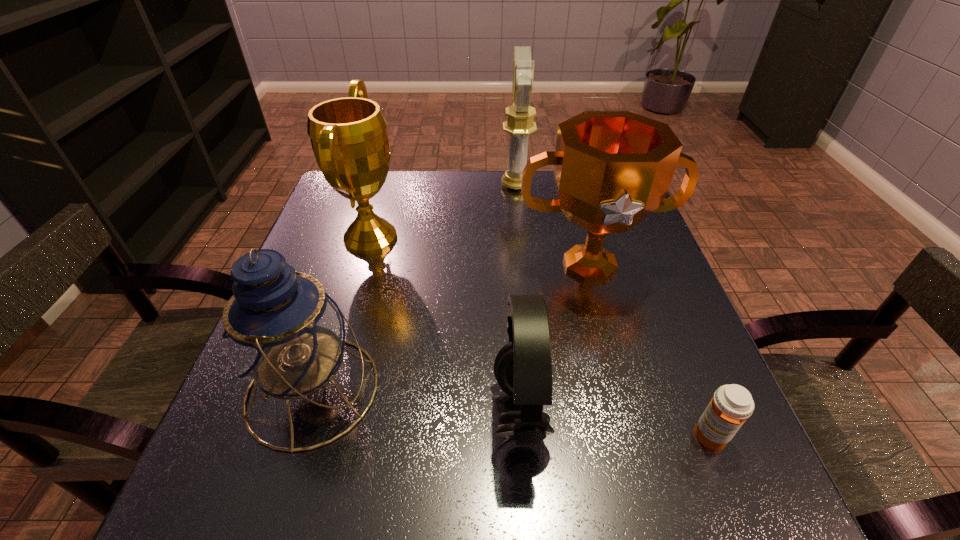
Where is `vacant space at the far edge of the desktop`? The width and height of the screenshot is (960, 540). vacant space at the far edge of the desktop is located at coordinates (408, 172).

Where is `blank space at the left edge of the desktop`? blank space at the left edge of the desktop is located at coordinates (335, 257).

Identify the location of vacant point at the right edge. (606, 291).

I want to click on vacant space at the far left corner, so (327, 209).

Locate an element on the screen. free spot between the leftmost award and the second shortest object is located at coordinates (445, 325).

Where is `free spot between the medicine and the farthest award`? This screenshot has width=960, height=540. free spot between the medicine and the farthest award is located at coordinates tap(613, 311).

In order to click on vacant space in between the leftmost award and the farthest object in this screenshot , I will do `click(444, 211)`.

Identify which object is the third closest to the farthest award. Please provide its 2D coordinates. Your answer should be formatted as a tuple, i.e. [(x, y)], where the tuple contains the x and y coordinates of a point satisfying the conditions above.

[(523, 368)]

I want to click on object that is the third closest to the earphone, so click(731, 405).

Select which award is the second closest to the shortest object. Please provide its 2D coordinates. Your answer should be formatted as a tuple, i.e. [(x, y)], where the tuple contains the x and y coordinates of a point satisfying the conditions above.

[(349, 138)]